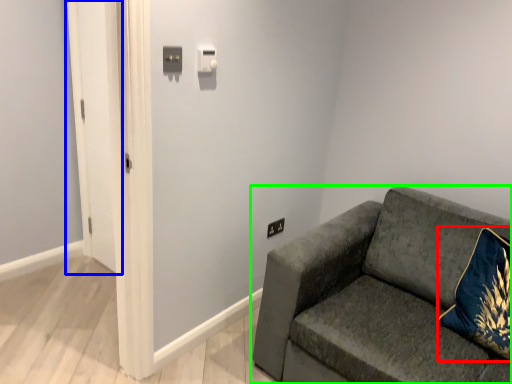
Question: Considering the real-world distances, which object is farthest from throw pillow (highlighted by a red box)? glass door (highlighted by a blue box) or studio couch (highlighted by a green box)?

Choices:
 (A) glass door
 (B) studio couch

Answer: (A)